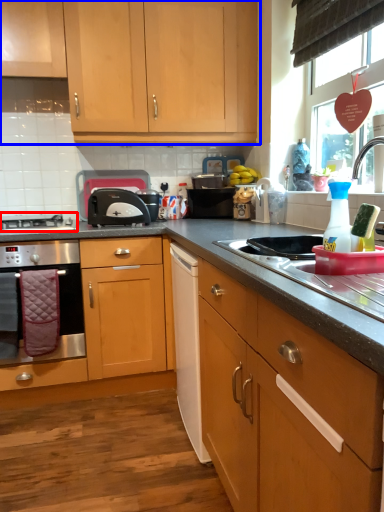
Question: Which point is further to the camera, gas stove (highlighted by a red box) or cabinetry (highlighted by a blue box)?

Choices:
 (A) gas stove
 (B) cabinetry

Answer: (A)